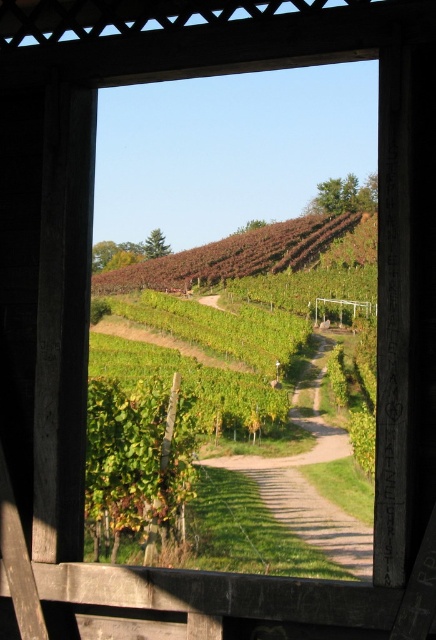
Question: Which of the following is the farthest from the observer?

Choices:
 (A) green grassy path at center
 (B) brown leafy hillside at upper center

Answer: (B)

Question: Among these objects, which one is farthest from the camera?

Choices:
 (A) brown leafy hillside at upper center
 (B) green grassy path at center

Answer: (A)

Question: Where is green grassy path at center located in relation to brown leafy hillside at upper center in the image?

Choices:
 (A) right
 (B) left

Answer: (B)

Question: Does green grassy path at center appear on the left side of brown leafy hillside at upper center?

Choices:
 (A) no
 (B) yes

Answer: (B)

Question: Does green grassy path at center appear on the left side of brown leafy hillside at upper center?

Choices:
 (A) no
 (B) yes

Answer: (B)